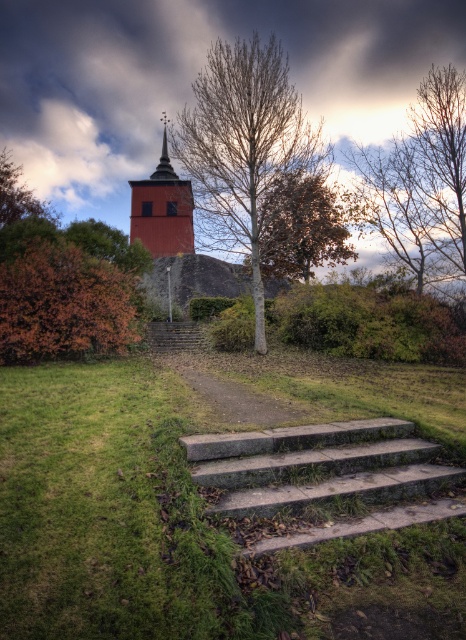
You are standing at the bottom of the gray concrete stairs at center and want to reach the top. Which set of stairs should you take to reach the top faster?

Both the gray concrete stairs at center and the concrete stairs at center lead to the same destination. Since the gray concrete stairs at center is shorter than the concrete stairs at center, taking the gray concrete stairs at center would allow you to reach the top faster.